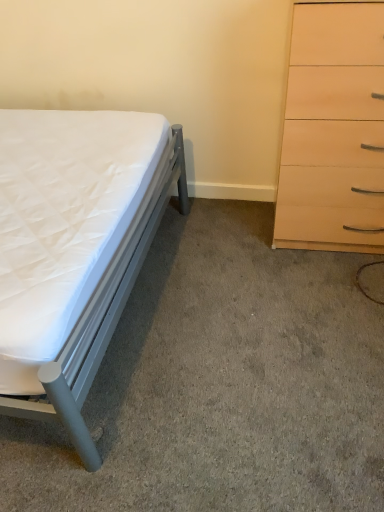
This screenshot has height=512, width=384. Identify the location of free space in front of light wood/finish chest of drawers at right. (322, 294).